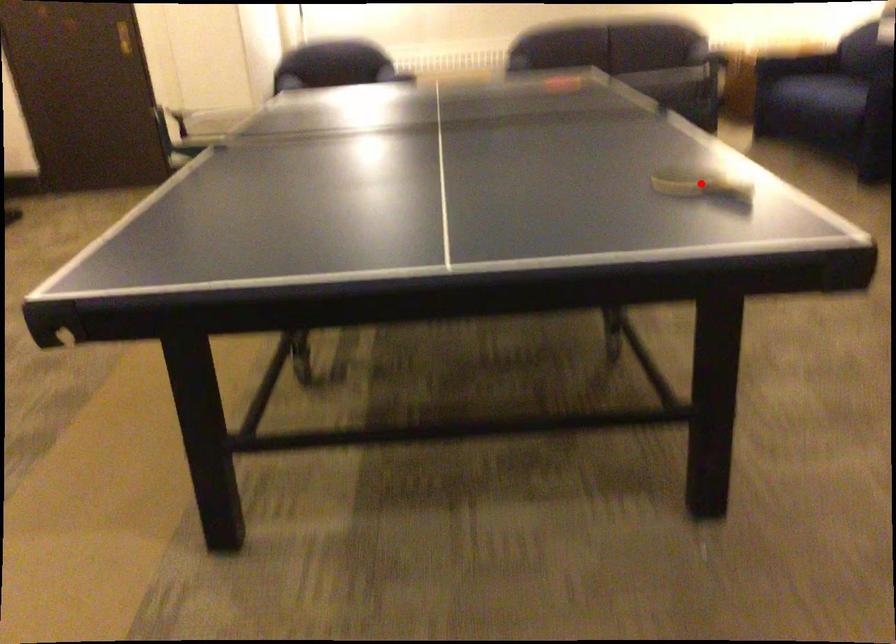
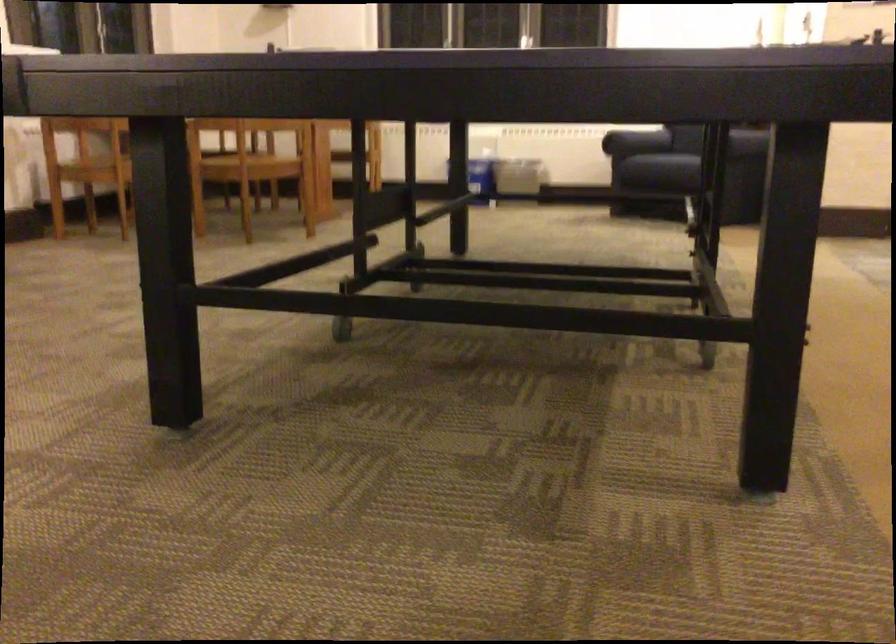
Question: I am providing you with two images of the same scene from different viewpoints. A red point is marked on the first image. At the location where the point appears in image 1, is it still visible in image 2?

Choices:
 (A) Yes
 (B) No

Answer: (B)